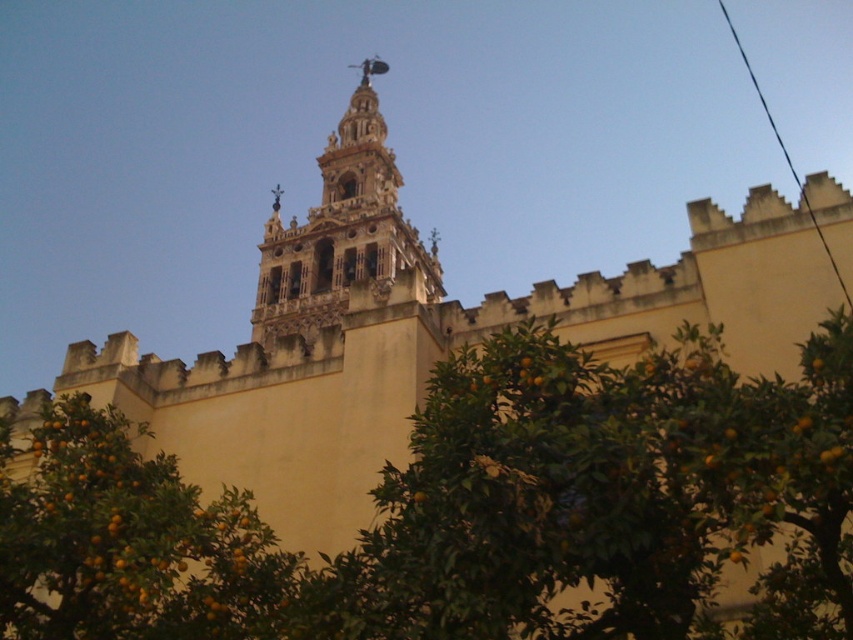
You are an architect examining the historic building. You notice the orange matte at lower left and the golden stone church tower at center. Which object is positioned lower in the image?

The orange matte at lower left is located below the golden stone church tower at center, so it is positioned lower in the image.

You are standing in front of the historic building and notice two elements in the scene. The first is an orange matte at lower left, and the second is a golden stone church tower at center. From your perspective, which object is positioned more to the left?

The orange matte at lower left is positioned more to the left than the golden stone church tower at center.

You are standing at the base of the historic building and want to take a photo of the point located at coordinates point (108, 483). Given that the camera you are using has a maximum focus range of 30 meters, will you be able to capture the point in focus without moving closer?

The point (108, 483) is 32.77 meters away from the camera, which exceeds the camera maximum focus range of 30 meters. Therefore, you won